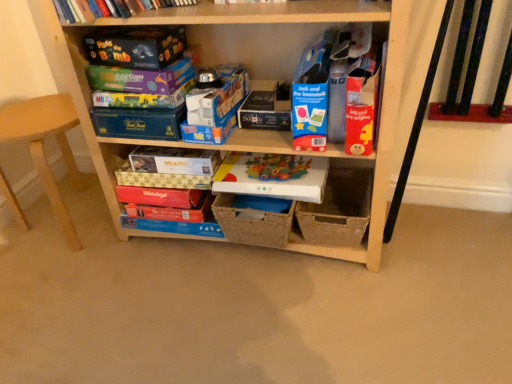
Question: Visually, is bright red cardboard book at upper center, the 4th paperback book from the top, positioned to the left or to the right of matte plastic board game at center, positioned as the sixth paperback book in top-to-bottom order?

Choices:
 (A) left
 (B) right

Answer: (B)

Question: From the image's perspective, is bright red cardboard book at upper center, the 4th paperback book from the top, positioned above or below matte plastic board game at center, which is the 2th paperback book from bottom to top?

Choices:
 (A) above
 (B) below

Answer: (A)

Question: Considering the real-world distances, which object is farthest from the matt black game box at upper left, placed as the seventh paperback book when sorted from bottom to top?

Choices:
 (A) white cardboard box at lower center
 (B) matte purple board game at center, the 5th paperback book in the bottom-to-top sequence
 (C) blue cardboard box at center, placed as the 2th storage box when sorted from top to bottom
 (D) matte cardboard book at upper center
 (E) natural woven basket at center, which is the 1th storage box from bottom to top

Answer: (A)

Question: Which object is the closest to the matt black game box at upper left, placed as the seventh paperback book when sorted from bottom to top?

Choices:
 (A) white cardboard box at lower center
 (B) wooden shelf at center
 (C) matte cardboard book at upper center
 (D) matte gold paperback book at center, arranged as the 5th paperback book when viewed from the top
 (E) red matte board game at lower center, the 7th paperback book viewed from the top

Answer: (B)